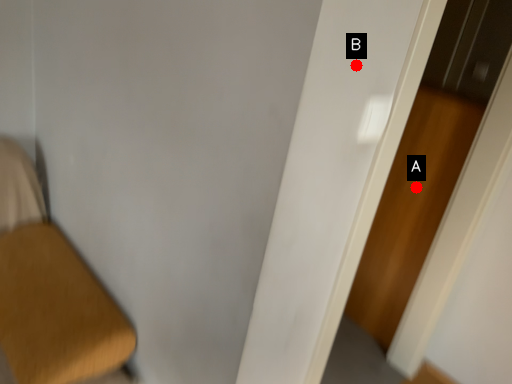
Question: Two points are circled on the image, labeled by A and B beside each circle. Among these points, which one is farthest from the camera?

Choices:
 (A) A is further
 (B) B is further

Answer: (A)